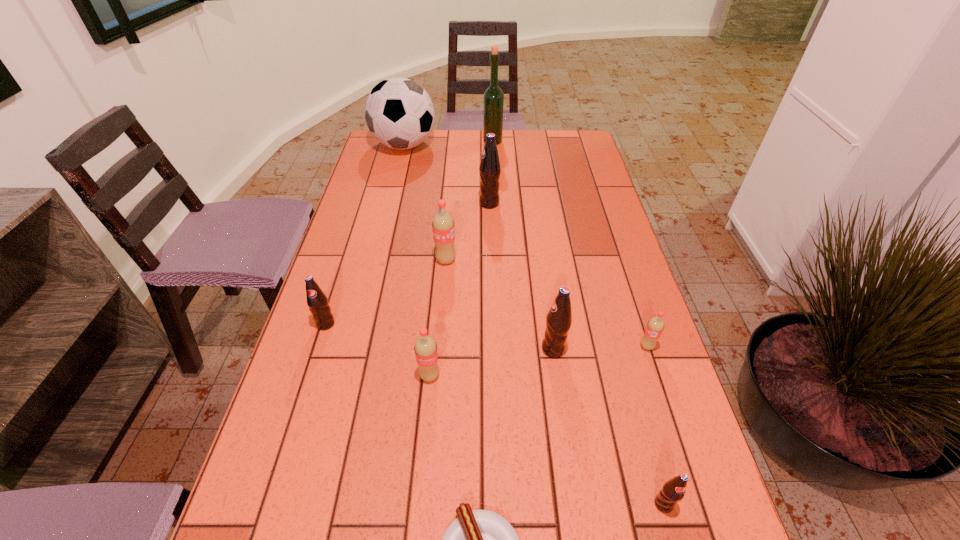
Locate an element on the screen. vacant point located between the farthest black pop and the eighth farthest object is located at coordinates (460, 289).

The height and width of the screenshot is (540, 960). In order to click on vacant area between the rightmost black pop and the third farthest pop in this screenshot , I will do `click(494, 414)`.

Where is `empty space between the second farthest black pop and the biggest black pop`? The width and height of the screenshot is (960, 540). empty space between the second farthest black pop and the biggest black pop is located at coordinates (407, 264).

I want to click on blank region between the green liquor and the nearest black pop, so click(578, 322).

Identify the location of vacant space that's between the third smallest black pop and the farthest pop. This screenshot has height=540, width=960. (521, 276).

Where is `free space that is in between the rightmost object and the eighth object from left to right`? free space that is in between the rightmost object and the eighth object from left to right is located at coordinates point(600,348).

Identify which object is the fifth closest to the second biggest red soda. Please provide its 2D coordinates. Your answer should be formatted as a tuple, i.e. [(x, y)], where the tuple contains the x and y coordinates of a point satisfying the conditions above.

[(673, 491)]

You are a GUI agent. You are given a task and a screenshot of the screen. Output one action in this format:
    pyautogui.click(x=<x>, y=<y>)
    Task: Click on the third closest object to the fourth farthest object
    
    Given the screenshot: What is the action you would take?
    pyautogui.click(x=559, y=318)

Point out which pop is positioned as the fourth nearest to the third pop from right to left. Please provide its 2D coordinates. Your answer should be formatted as a tuple, i.e. [(x, y)], where the tuple contains the x and y coordinates of a point satisfying the conditions above.

[(443, 226)]

This screenshot has height=540, width=960. What are the coordinates of `the second closest pop to the sausage` in the screenshot? It's located at (426, 352).